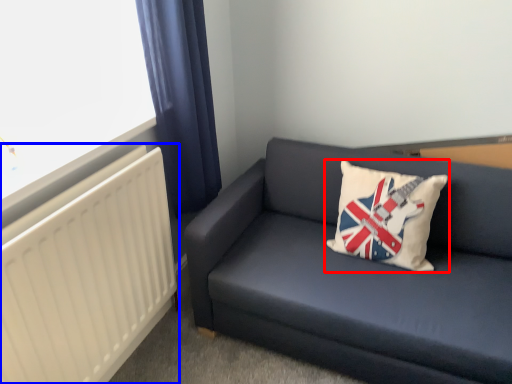
Question: Which object is closer to the camera taking this photo, pillow (highlighted by a red box) or radiator (highlighted by a blue box)?

Choices:
 (A) pillow
 (B) radiator

Answer: (B)